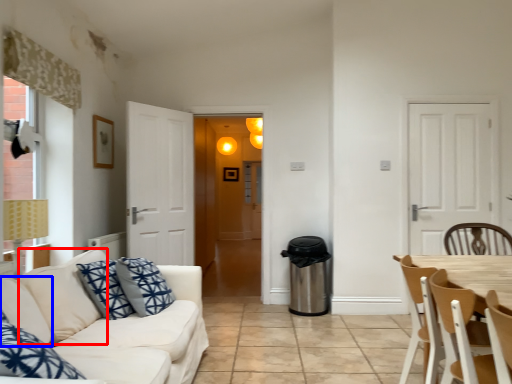
Question: Which of the following is the farthest to the observer, pillow (highlighted by a red box) or pillow (highlighted by a blue box)?

Choices:
 (A) pillow
 (B) pillow

Answer: (B)